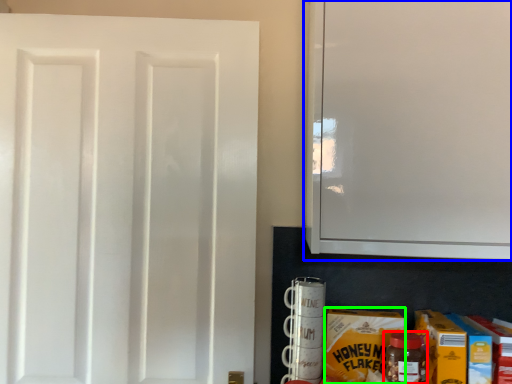
Question: Which object is positioned farthest from bottle (highlighted by a red box)? Select from cabinetry (highlighted by a blue box) and carton (highlighted by a green box).

Choices:
 (A) cabinetry
 (B) carton

Answer: (A)